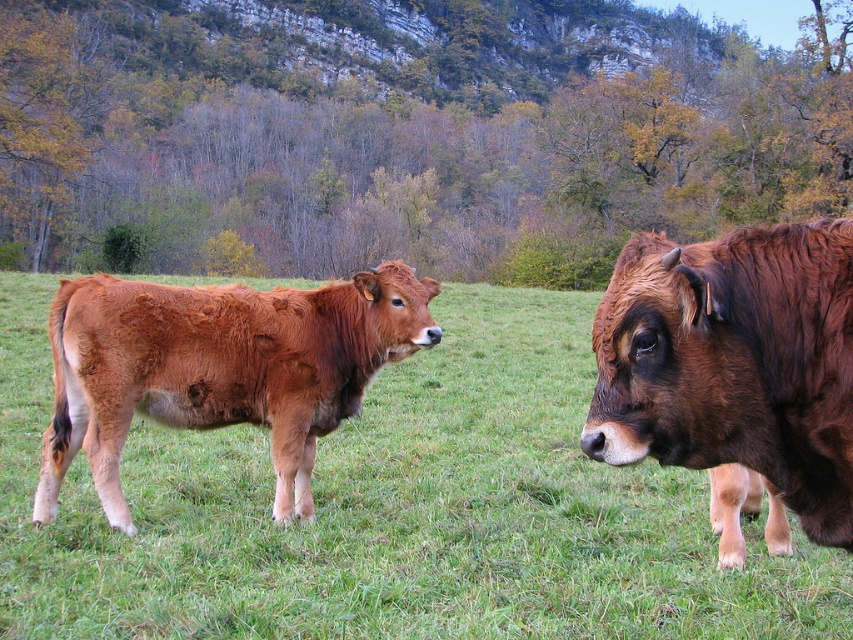
You are a photographer trying to capture both the green grass at center and the brown furry calf at left in the same frame. Based on their positions, which object is closer to the left edge of the photo?

The brown furry calf at left is closer to the left edge of the photo because the green grass at center is to the left of it, meaning the calf is positioned more to the right compared to the grass.

You are a drone operator flying over a grassy field with two cows. Your drone is currently at the point marked by point (393,509), which is above green grass at center. You need to fly towards the cow on the right. Which direction should you steer the drone to reach the cow on the right from your current position?

The cow on the right is located to the right side of the frame. Since the drone is currently above the green grass at center, you should steer the drone to the right to reach the cow on the right.

Looking at this image, you are a farmer checking the pasture. You notice the brown glossy cow at right and the brown furry calf at left. Which animal is standing closer to the fence located at the far edge of the field?

The brown glossy cow at right is positioned over brown furry calf at left, so the calf is farther away from the fence located at the far edge of the field. Therefore, the brown glossy cow at right is closer to the fence.